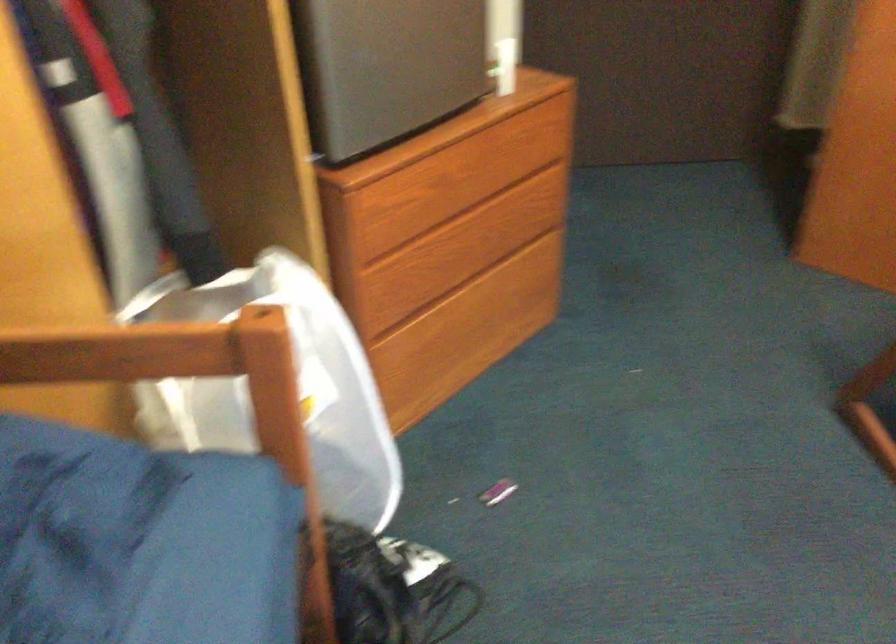
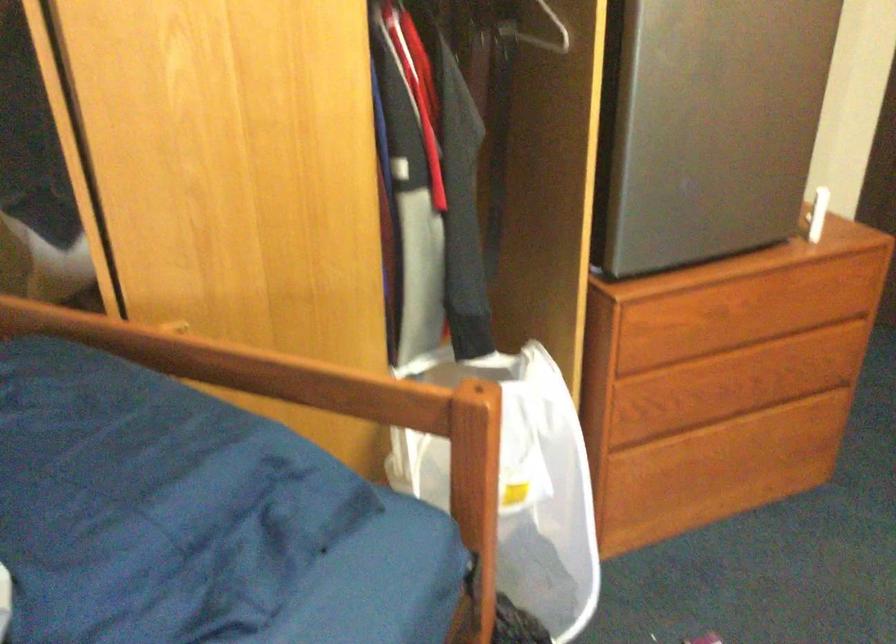
Question: The camera is either moving clockwise (left) or counter-clockwise (right) around the object. The first image is from the beginning of the video and the second image is from the end. Is the camera moving left or right when shooting the video?

Choices:
 (A) Left
 (B) Right

Answer: (B)